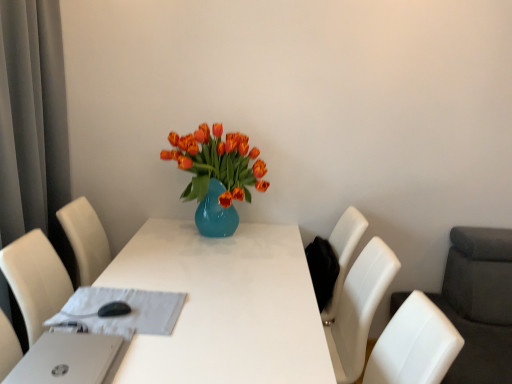
Consider the image. In order to face white fabric at center, should I rotate leftwards or rightwards?

Turn left approximately 17.439 degrees to face it.

Locate an element on the screen. This screenshot has height=384, width=512. gray fabric curtain at left is located at coordinates (33, 124).

The image size is (512, 384). I want to click on white glossy table at center, so click(x=223, y=307).

The height and width of the screenshot is (384, 512). I want to click on white fabric at center, so click(x=124, y=314).

From the image's perspective, is gray fabric curtain at left positioned above or below matte blue vase at center?

gray fabric curtain at left is situated higher than matte blue vase at center in the image.

Is gray fabric curtain at left positioned beyond the bounds of matte blue vase at center?

Yes.

From a real-world perspective, is gray fabric curtain at left physically located above or below matte blue vase at center?

gray fabric curtain at left is situated higher than matte blue vase at center in the real world.

From the image's perspective, which object appears higher, white plastic laptop at lower left or white fabric at center?

white fabric at center is shown above in the image.

Which is correct: white plastic laptop at lower left is inside white fabric at center, or outside of it?

white plastic laptop at lower left is outside white fabric at center.

Are white plastic laptop at lower left and white fabric at center making contact?

No, white plastic laptop at lower left is not beside white fabric at center.

The width and height of the screenshot is (512, 384). I want to click on computer on the left of white fabric at center, so point(66,359).

Where is `cloth lying above the white glossy table at center (from the image's perspective)`? The height and width of the screenshot is (384, 512). cloth lying above the white glossy table at center (from the image's perspective) is located at coordinates (124, 314).

Visually, is white glossy table at center positioned to the left or to the right of white fabric at center?

Based on their positions, white glossy table at center is located to the right of white fabric at center.

Which object is thinner, white glossy table at center or white fabric at center?

white fabric at center is thinner.

Consider the image. Is white glossy table at center looking in the opposite direction of white fabric at center?

No, white fabric at center is not at the back of white glossy table at center.

Based on the photo, are white fabric at center and matte blue vase at center beside each other?

No, white fabric at center is not with matte blue vase at center.

Is point (173, 297) closer to camera compared to point (218, 133)?

Yes, it is.

Between white fabric at center and matte blue vase at center, which one has smaller size?

With smaller size is white fabric at center.

Consider the image. Based on their positions, is white plastic laptop at lower left located to the left or right of white glossy table at center?

Based on their positions, white plastic laptop at lower left is located to the left of white glossy table at center.

Is white plastic laptop at lower left positioned far away from white glossy table at center?

No, white plastic laptop at lower left is in close proximity to white glossy table at center.

Is white plastic laptop at lower left not within white glossy table at center?

No, white plastic laptop at lower left is inside or overlapping with white glossy table at center.

Between white plastic laptop at lower left and white glossy table at center, which one is positioned in front?

white plastic laptop at lower left.

Does point (167, 309) come farther from viewer compared to point (77, 365)?

That is True.

Does white fabric at center have a greater height compared to white plastic laptop at lower left?

No, white fabric at center is not taller than white plastic laptop at lower left.

From a real-world perspective, does white fabric at center sit lower than white plastic laptop at lower left?

Correct, in the physical world, white fabric at center is lower than white plastic laptop at lower left.

Is the depth of white fabric at center less than that of white plastic laptop at lower left?

That is False.

Is white fabric at center far from gray fabric curtain at left?

No, white fabric at center is not far from gray fabric curtain at left.

Based on the photo, which object is wider, white fabric at center or gray fabric curtain at left?

white fabric at center is wider.

Do you think white fabric at center is within gray fabric curtain at left, or outside of it?

The correct answer is: outside.

Is white fabric at center to the left of gray fabric curtain at left from the viewer's perspective?

No.

Find the location of `flower that appears below the gray fabric curtain at left (from the image's perspective)`. flower that appears below the gray fabric curtain at left (from the image's perspective) is located at coordinates (217, 163).

Where is `computer in front of the white fabric at center`? computer in front of the white fabric at center is located at coordinates (66, 359).

Considering their positions, is matte blue vase at center positioned closer to white fabric at center than white glossy table at center?

Among the two, white glossy table at center is located nearer to white fabric at center.

From the picture: Estimate the real-world distances between objects in this image. Which object is further from gray fabric curtain at left, white glossy table at center or matte blue vase at center?

white glossy table at center is further to gray fabric curtain at left.

Estimate the real-world distances between objects in this image. Which object is further from white plastic laptop at lower left, white glossy table at center or white fabric at center?

Among the two, white glossy table at center is located further to white plastic laptop at lower left.

Estimate the real-world distances between objects in this image. Which object is further from matte blue vase at center, gray fabric curtain at left or white glossy table at center?

gray fabric curtain at left is further to matte blue vase at center.

Based on their spatial positions, is white fabric at center or white glossy table at center closer to white plastic laptop at lower left?

The object closer to white plastic laptop at lower left is white fabric at center.

When comparing their distances from white glossy table at center, does matte blue vase at center or white plastic laptop at lower left seem further?

white plastic laptop at lower left is positioned further to the anchor white glossy table at center.

From the image, which object appears to be nearer to white fabric at center, white glossy table at center or white plastic laptop at lower left?

white plastic laptop at lower left is closer to white fabric at center.

Looking at the image, which one is located closer to matte blue vase at center, white plastic laptop at lower left or white glossy table at center?

Based on the image, white glossy table at center appears to be nearer to matte blue vase at center.

The image size is (512, 384). Identify the location of cloth that lies between gray fabric curtain at left and white plastic laptop at lower left from top to bottom. (124, 314).

Identify the location of cloth between white plastic laptop at lower left and matte blue vase at center in the front-back direction. (124, 314).

This screenshot has height=384, width=512. In order to click on cloth between gray fabric curtain at left and matte blue vase at center in this screenshot , I will do `click(124, 314)`.

Locate an element on the screen. This screenshot has height=384, width=512. cloth that lies between matte blue vase at center and white glossy table at center from top to bottom is located at coordinates (124, 314).